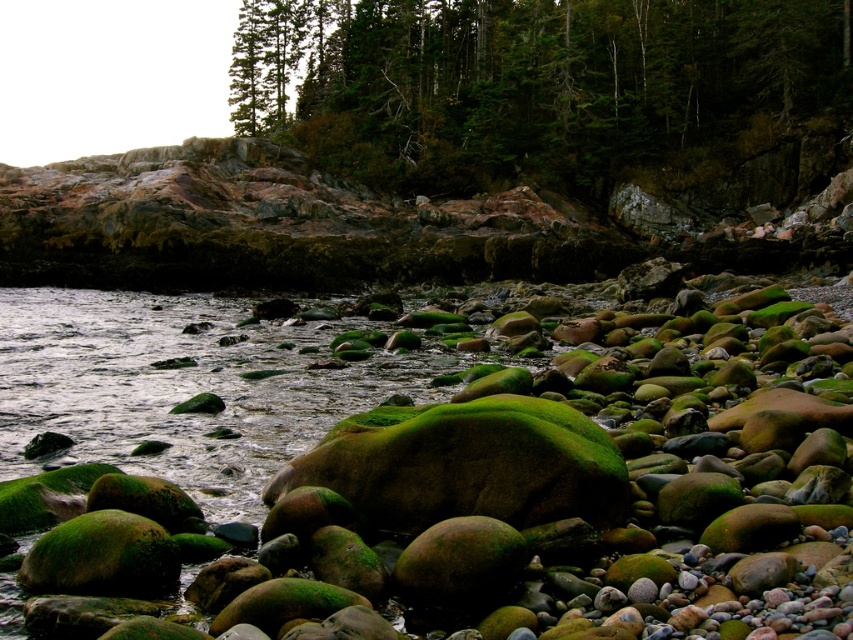
Question: Which point appears closest to the camera in this image?

Choices:
 (A) (103, 401)
 (B) (650, 136)

Answer: (A)

Question: Which point is closer to the camera taking this photo?

Choices:
 (A) (177, 429)
 (B) (679, 115)

Answer: (A)

Question: Does green textured tree at upper center appear under green mossy rock at center?

Choices:
 (A) no
 (B) yes

Answer: (A)

Question: In this image, where is green textured tree at upper center located relative to green mossy rock at center?

Choices:
 (A) above
 (B) below

Answer: (A)

Question: Where is green textured tree at upper center located in relation to green mossy rock at center in the image?

Choices:
 (A) below
 (B) above

Answer: (B)

Question: Which object is closer to the camera taking this photo?

Choices:
 (A) green textured tree at upper center
 (B) green mossy rock at center

Answer: (B)